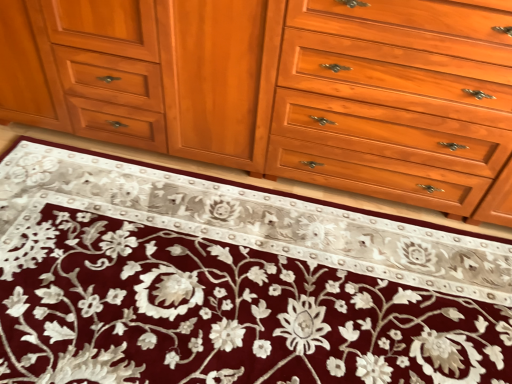
Question: Should I look upward or downward to see maroon velvet rug at center?

Choices:
 (A) down
 (B) up

Answer: (A)

Question: Can you confirm if maroon velvet rug at center is bigger than light brown wood drawer at center?

Choices:
 (A) no
 (B) yes

Answer: (A)

Question: From a real-world perspective, is maroon velvet rug at center located higher than light brown wood drawer at center?

Choices:
 (A) no
 (B) yes

Answer: (A)

Question: Does maroon velvet rug at center have a greater height compared to light brown wood drawer at center?

Choices:
 (A) no
 (B) yes

Answer: (A)

Question: Does maroon velvet rug at center have a lesser width compared to light brown wood drawer at center?

Choices:
 (A) yes
 (B) no

Answer: (B)

Question: From the image's perspective, is maroon velvet rug at center on top of light brown wood drawer at center?

Choices:
 (A) yes
 (B) no

Answer: (B)

Question: Considering the relative sizes of maroon velvet rug at center and light brown wood drawer at center in the image provided, is maroon velvet rug at center wider than light brown wood drawer at center?

Choices:
 (A) no
 (B) yes

Answer: (B)

Question: Can you confirm if light brown wood drawer at center is smaller than maroon velvet rug at center?

Choices:
 (A) yes
 (B) no

Answer: (B)

Question: Does light brown wood drawer at center have a larger size compared to maroon velvet rug at center?

Choices:
 (A) no
 (B) yes

Answer: (B)

Question: Is light brown wood drawer at center not inside maroon velvet rug at center?

Choices:
 (A) no
 (B) yes

Answer: (B)

Question: Is light brown wood drawer at center wider than maroon velvet rug at center?

Choices:
 (A) no
 (B) yes

Answer: (A)

Question: Does light brown wood drawer at center lie in front of maroon velvet rug at center?

Choices:
 (A) yes
 (B) no

Answer: (B)

Question: From the image's perspective, is light brown wood drawer at center on top of maroon velvet rug at center?

Choices:
 (A) no
 (B) yes

Answer: (B)

Question: Is matte wood cabinet at center directly adjacent to light brown wood drawer at center?

Choices:
 (A) no
 (B) yes

Answer: (A)